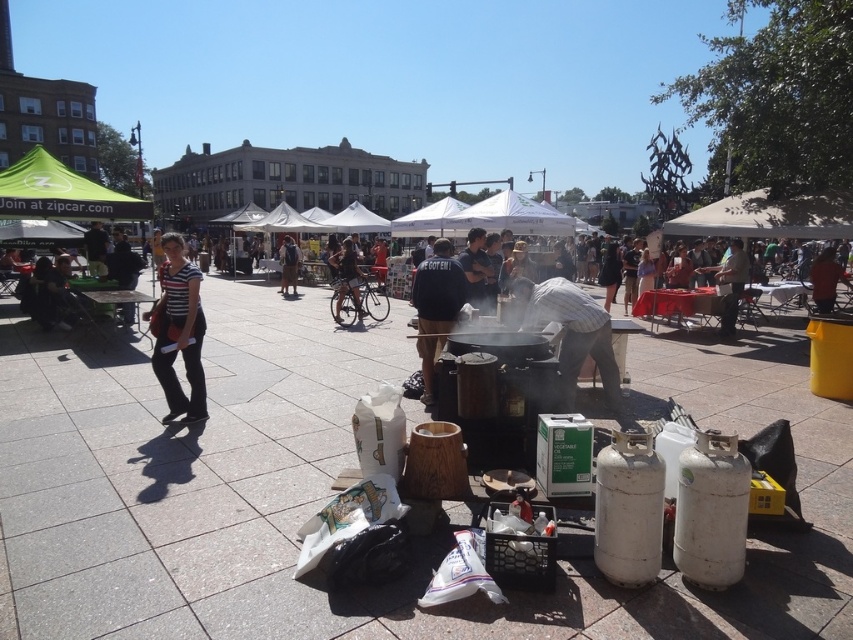
Which is behind, point (184, 284) or point (520, 204)?

Point (520, 204)

Between white striped shirt at center and white fabric canopy at center, which one has less height?

Standing shorter between the two is white fabric canopy at center.

Between point (196, 385) and point (548, 225), which one is positioned in front?

Point (196, 385)

Where is `white striped shirt at center`? white striped shirt at center is located at coordinates (178, 332).

Is white striped shirt at center to the left of dark blue jeans at center from the viewer's perspective?

Correct, you'll find white striped shirt at center to the left of dark blue jeans at center.

Does white striped shirt at center have a greater height compared to dark blue jeans at center?

Indeed, white striped shirt at center has a greater height compared to dark blue jeans at center.

The height and width of the screenshot is (640, 853). Describe the element at coordinates (178, 332) in the screenshot. I see `white striped shirt at center` at that location.

Where is `white striped shirt at center`? This screenshot has width=853, height=640. white striped shirt at center is located at coordinates (178, 332).

Can you confirm if gray striped shirt at center is positioned below white striped shirt at center?

Indeed, gray striped shirt at center is positioned under white striped shirt at center.

Can you confirm if gray striped shirt at center is wider than white striped shirt at center?

In fact, gray striped shirt at center might be narrower than white striped shirt at center.

I want to click on gray striped shirt at center, so click(569, 332).

Locate an element on the screen. Image resolution: width=853 pixels, height=640 pixels. gray striped shirt at center is located at coordinates (569, 332).